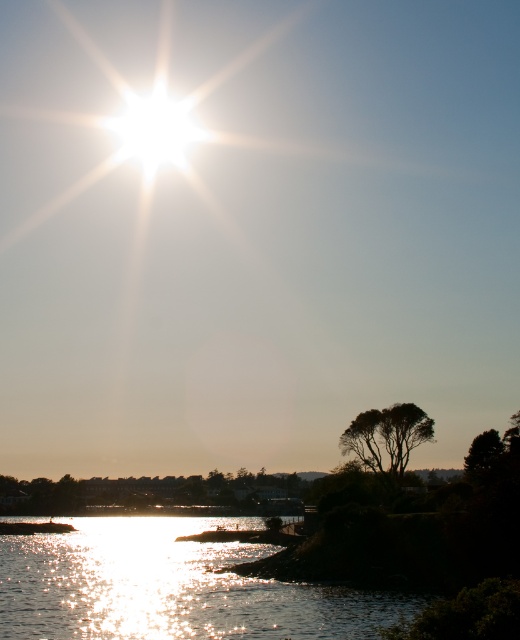
Question: Can you confirm if silhouette leafy tree at lower right is wider than green matte tree at lower right?

Choices:
 (A) yes
 (B) no

Answer: (A)

Question: Estimate the real-world distances between objects in this image. Which object is farther from the shiny reflective water at lower center?

Choices:
 (A) silhouette leafy tree at lower right
 (B) green matte tree at lower right

Answer: (B)

Question: Can you confirm if shiny reflective water at lower center is positioned below green matte tree at lower right?

Choices:
 (A) no
 (B) yes

Answer: (B)

Question: Which object is positioned closest to the silhouette leafy tree at lower right?

Choices:
 (A) shiny reflective water at lower center
 (B) green matte tree at lower right

Answer: (B)

Question: Which is farther from the green matte tree at lower right?

Choices:
 (A) shiny reflective water at lower center
 (B) silhouette leafy tree at lower right

Answer: (A)

Question: Is shiny reflective water at lower center bigger than silhouette leafy tree at lower right?

Choices:
 (A) no
 (B) yes

Answer: (B)